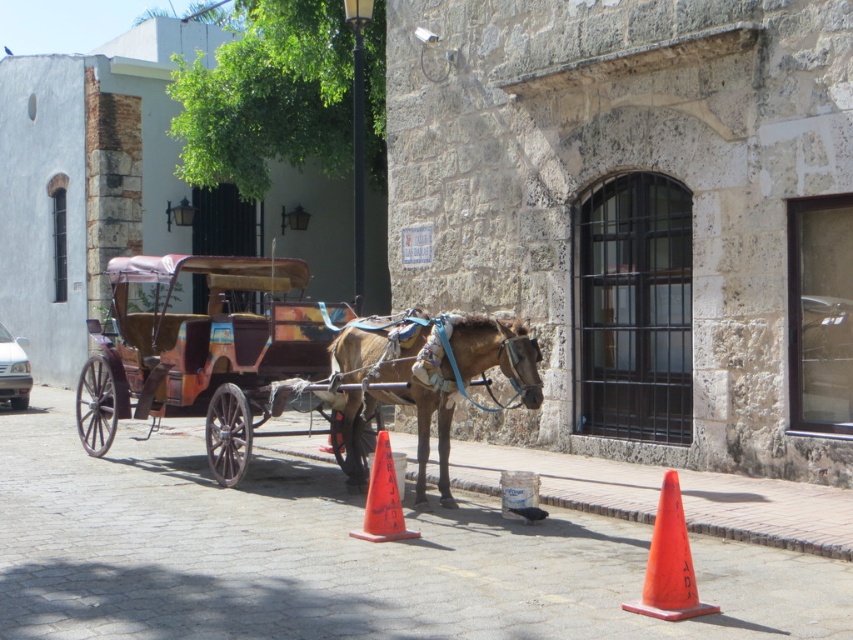
Describe the element at coordinates (669, 563) in the screenshot. I see `orange plastic traffic cone at lower right` at that location.

In order to click on orange plastic traffic cone at lower right in this screenshot , I will do `click(669, 563)`.

Looking at this image, who is positioned more to the right, wooden polished cart at center or orange plastic cone at lower center?

From the viewer's perspective, orange plastic cone at lower center appears more on the right side.

Who is more distant from viewer, (292, 364) or (364, 531)?

Point (292, 364)

What do you see at coordinates (286, 362) in the screenshot? The height and width of the screenshot is (640, 853). I see `wooden polished cart at center` at bounding box center [286, 362].

Locate an element on the screen. wooden polished cart at center is located at coordinates (286, 362).

Does brown leather horse at center appear on the left side of orange plastic traffic cone at lower right?

Indeed, brown leather horse at center is positioned on the left side of orange plastic traffic cone at lower right.

The image size is (853, 640). I want to click on brown leather horse at center, so click(x=428, y=381).

Is point (364, 404) less distant than point (654, 557)?

That is False.

The height and width of the screenshot is (640, 853). I want to click on brown leather horse at center, so click(x=428, y=381).